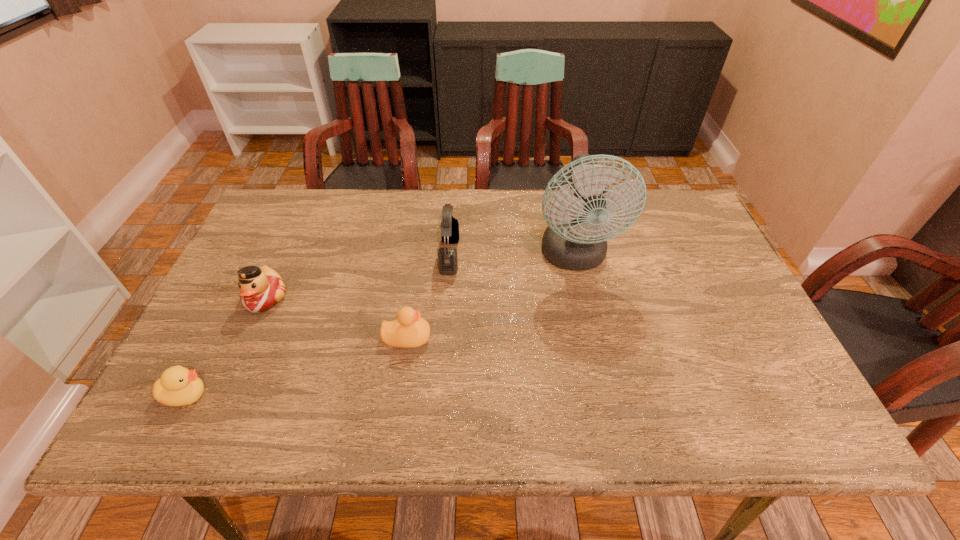
Identify the location of free location that satisfies the following two spatial constraints: 1. in front of the rightmost object where the airflow is directed; 2. on the face of the rightmost duck. This screenshot has height=540, width=960. (592, 338).

The width and height of the screenshot is (960, 540). I want to click on vacant region that satisfies the following two spatial constraints: 1. on the headband of the second tallest object; 2. on the face of the farthest duck, so click(x=446, y=299).